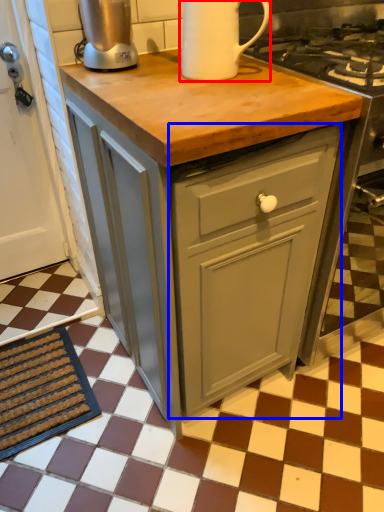
Question: Which object is closer to the camera taking this photo, kitchen appliance (highlighted by a red box) or cabinetry (highlighted by a blue box)?

Choices:
 (A) kitchen appliance
 (B) cabinetry

Answer: (A)